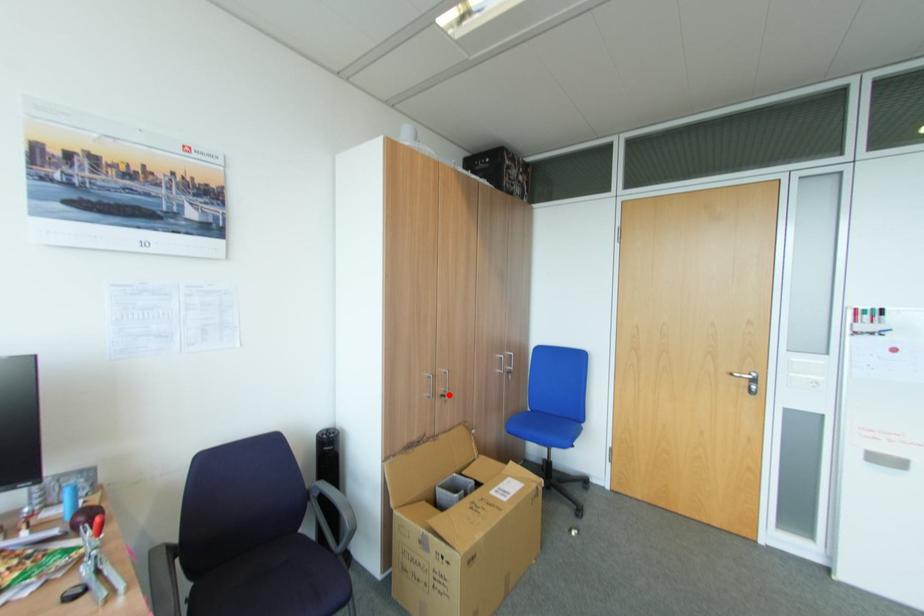
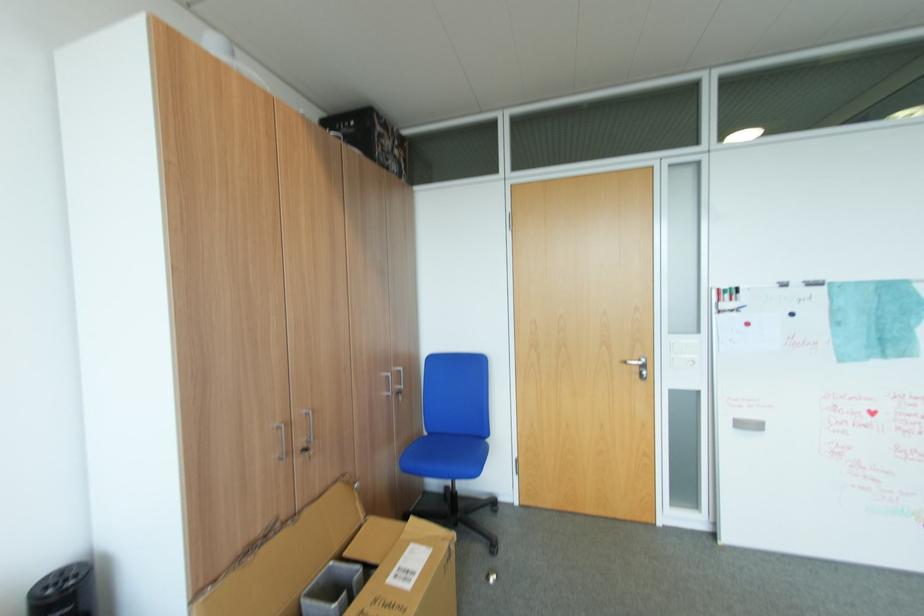
The point at the highlighted location is marked in the first image. Where is the corresponding point in the second image?

(310, 451)